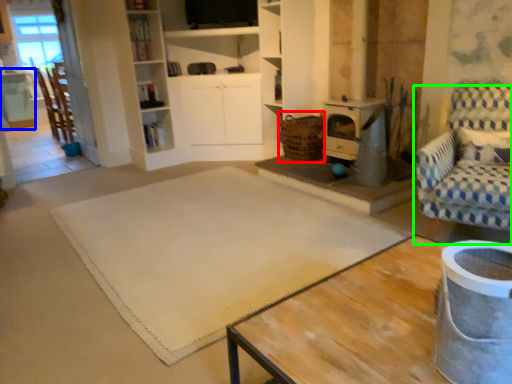
Question: Which object is positioned farthest from basket (highlighted by a red box)? Select from table (highlighted by a blue box) and chair (highlighted by a green box).

Choices:
 (A) table
 (B) chair

Answer: (A)